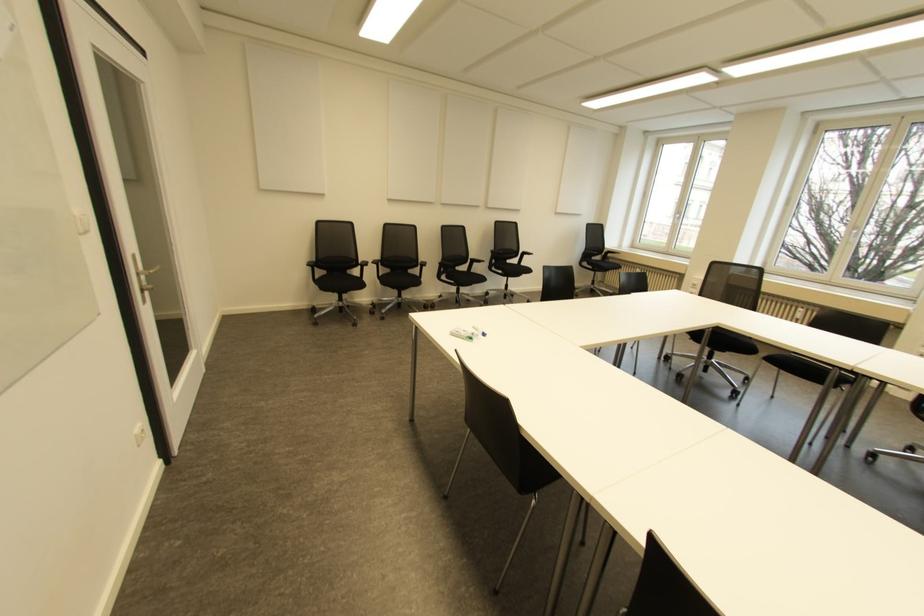
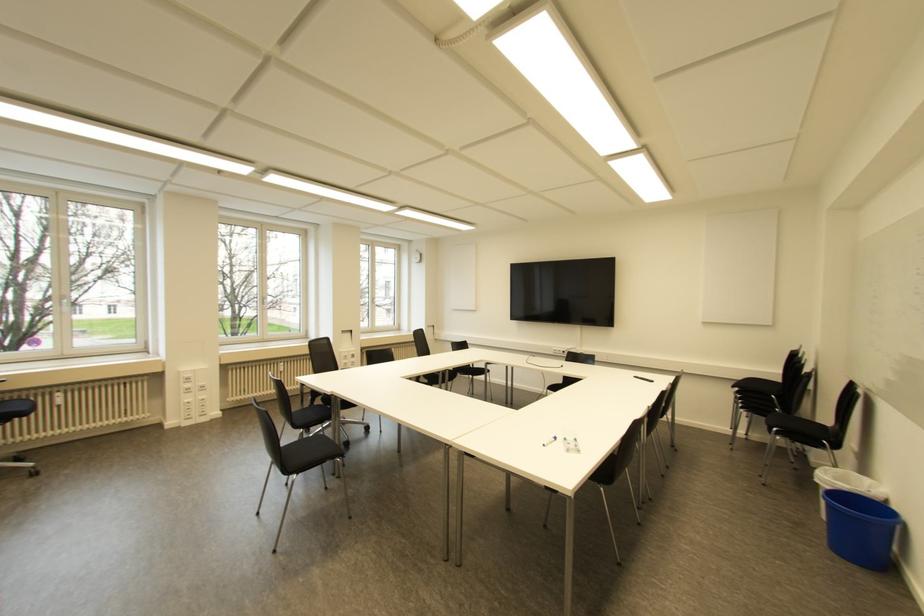
Find the pixel in the second image that matches point 483,334 in the first image.

(554, 438)